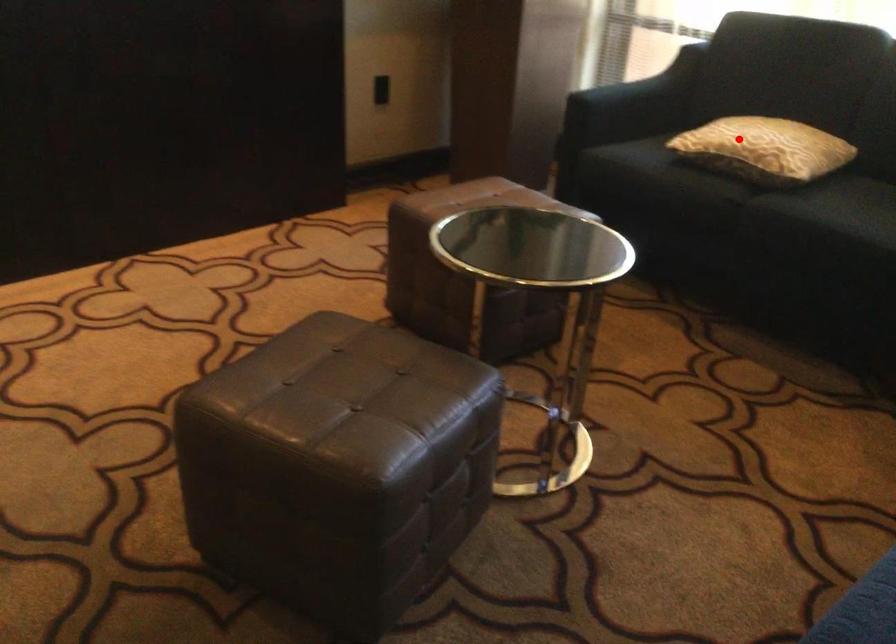
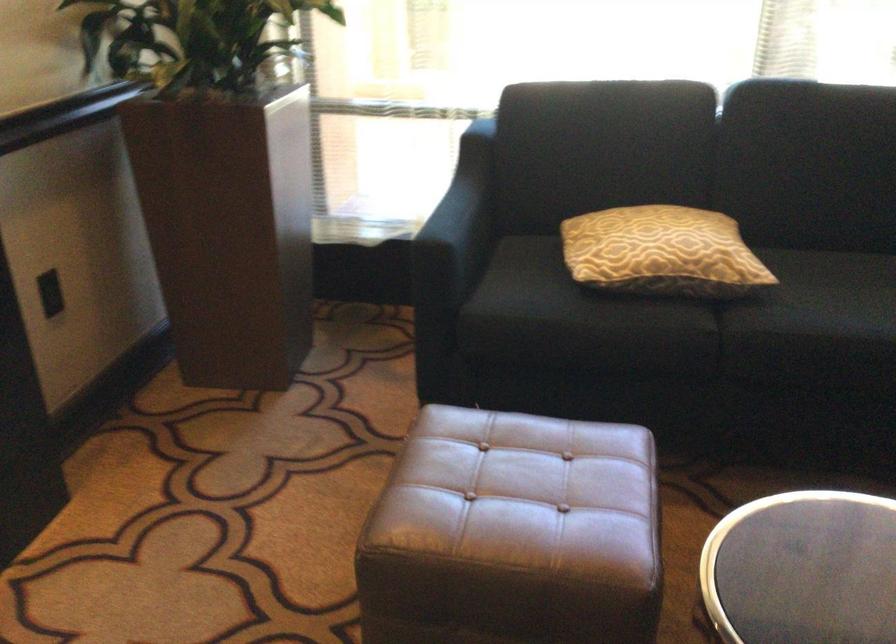
Question: I am providing you with two images of the same scene from different viewpoints. In image1, a red point is highlighted. Considering the same 3D point in image2, which of the following is correct?

Choices:
 (A) It is closer
 (B) It is farther

Answer: (A)